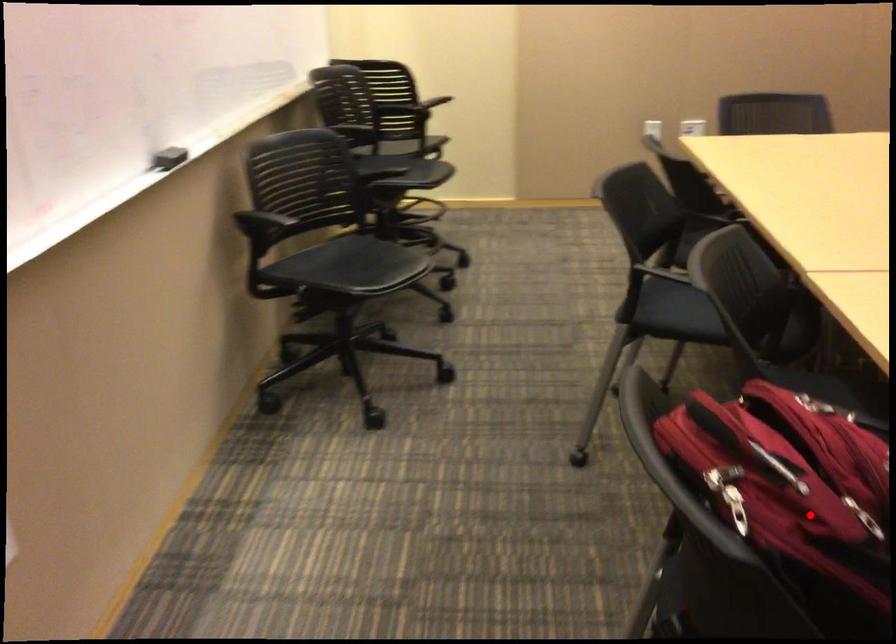
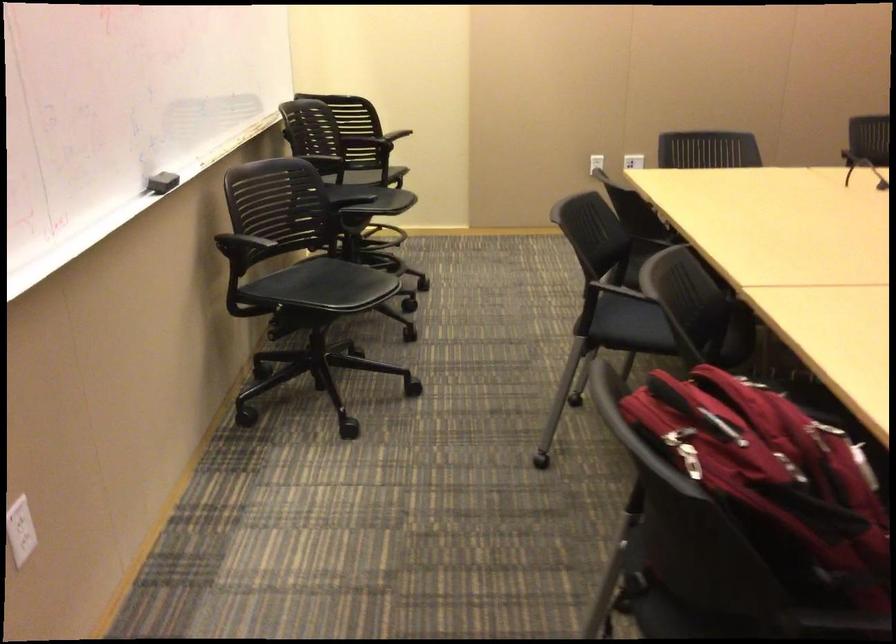
Question: I am providing you with two images of the same scene from different viewpoints. Image1 has a red point marked. In image2, the corresponding 3D location appears at what relative position? Reply with the corresponding letter.

Choices:
 (A) Closer
 (B) Farther

Answer: (B)